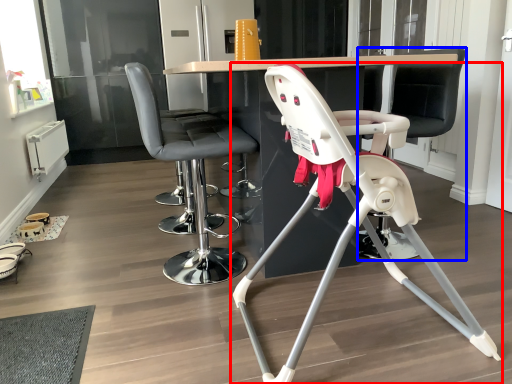
Question: Among these objects, which one is farthest to the camera, chair (highlighted by a red box) or swivel chair (highlighted by a blue box)?

Choices:
 (A) chair
 (B) swivel chair

Answer: (B)